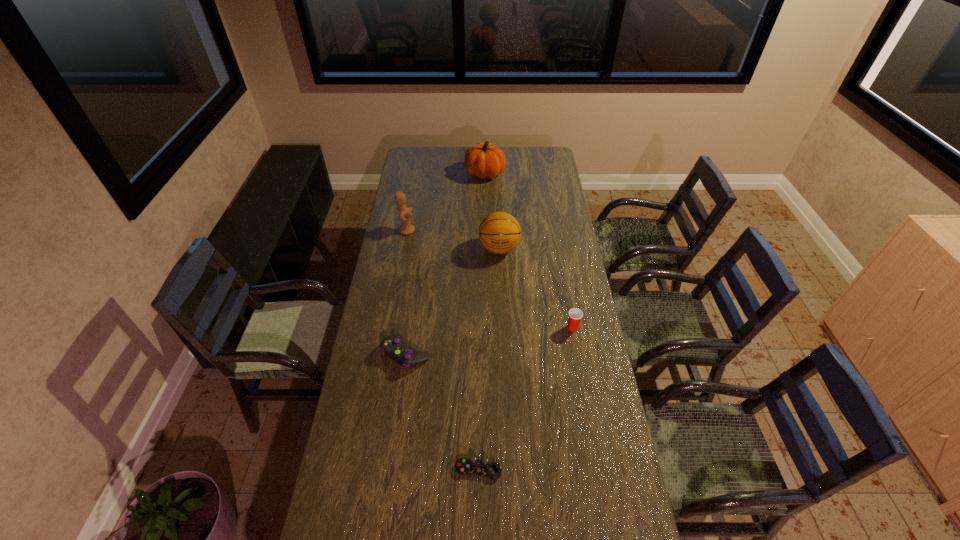
Locate an element on the screen. This screenshot has width=960, height=540. free location located 0.320m on the front of the farthest object is located at coordinates (486, 220).

Where is `vacant space located 0.190m on the surface of the basketball near the brand logo`? Image resolution: width=960 pixels, height=540 pixels. vacant space located 0.190m on the surface of the basketball near the brand logo is located at coordinates (501, 293).

The image size is (960, 540). Find the location of `vacant area situated 0.230m on the back of the rightmost object`. vacant area situated 0.230m on the back of the rightmost object is located at coordinates (564, 281).

Find the location of a particular element. blank area located 0.200m on the right of the taller control is located at coordinates (483, 354).

Image resolution: width=960 pixels, height=540 pixels. Identify the location of free point located on the left of the nearest object. (414, 469).

Identify the location of object located in the far edge section of the desktop. The image size is (960, 540). (483, 160).

I want to click on figurine that is at the left edge, so click(x=406, y=228).

Where is `control at the left edge`? This screenshot has width=960, height=540. control at the left edge is located at coordinates (401, 353).

What are the coordinates of `object that is positioned at the right edge` in the screenshot? It's located at 575,315.

Locate an element on the screen. The height and width of the screenshot is (540, 960). vacant area at the far edge is located at coordinates (451, 154).